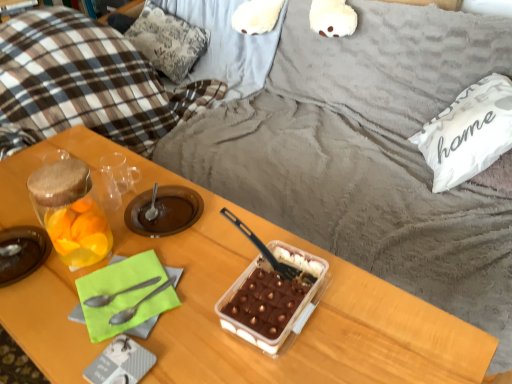
The image size is (512, 384). I want to click on vacant area on the back side of translucent glass jar at left, the first snack in the left-to-right sequence, so (121, 193).